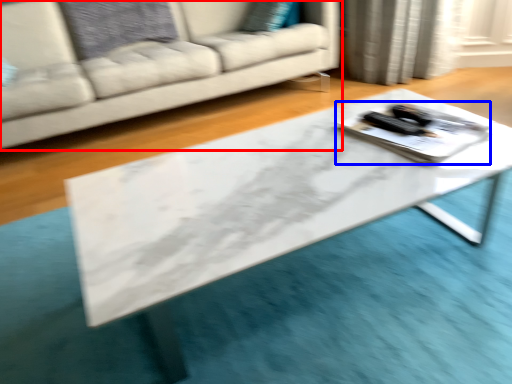
Question: Among these objects, which one is nearest to the camera, studio couch (highlighted by a red box) or tray (highlighted by a blue box)?

Choices:
 (A) studio couch
 (B) tray

Answer: (B)